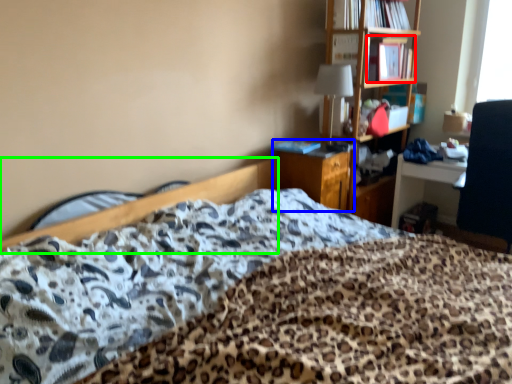
Question: Which is farther away from book (highlighted by a red box)? file cabinet (highlighted by a blue box) or bed frame (highlighted by a green box)?

Choices:
 (A) file cabinet
 (B) bed frame

Answer: (B)